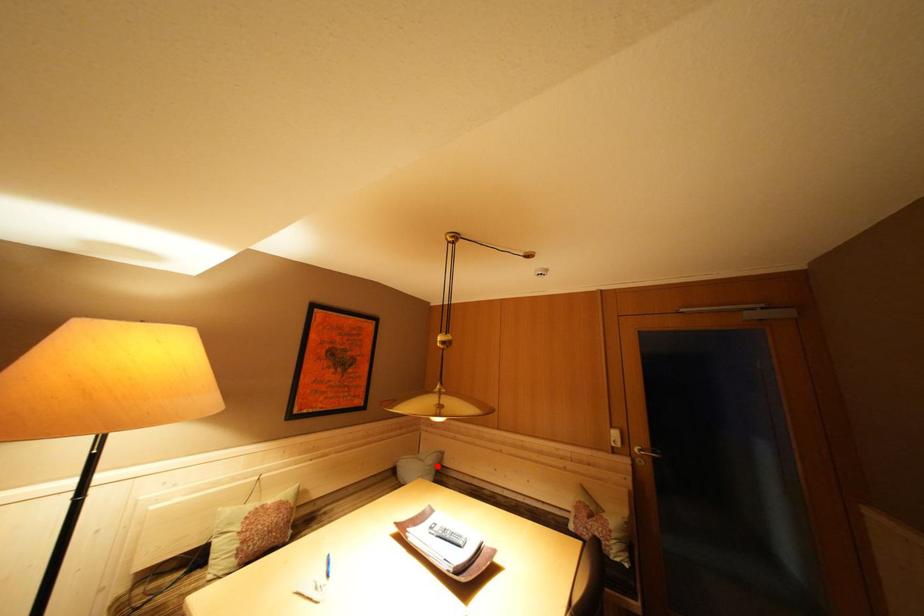
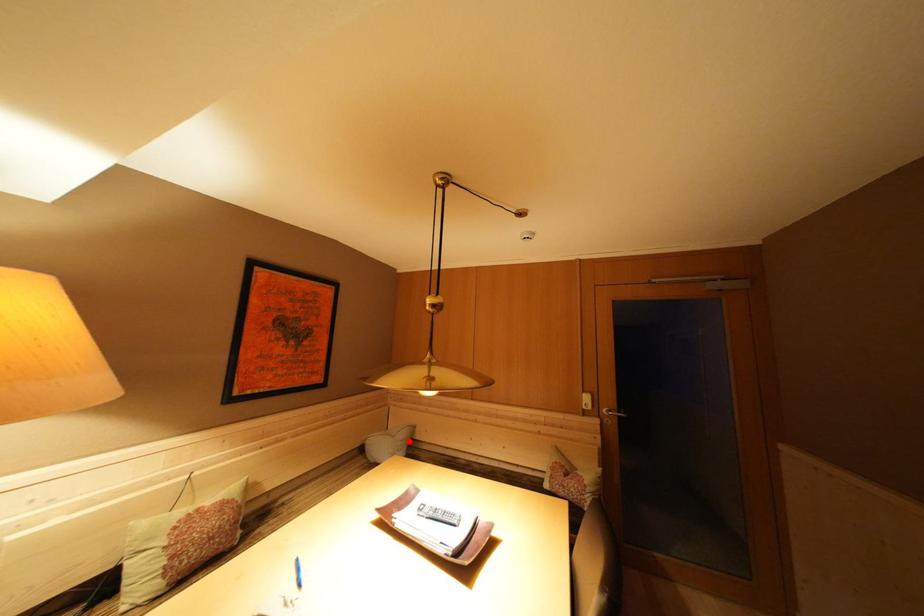
I am providing you with two images of the same scene from different viewpoints. A red point is marked on the first image and another point is marked on the second image. Is the marked point in image1 the same physical position as the marked point in image2?

Yes